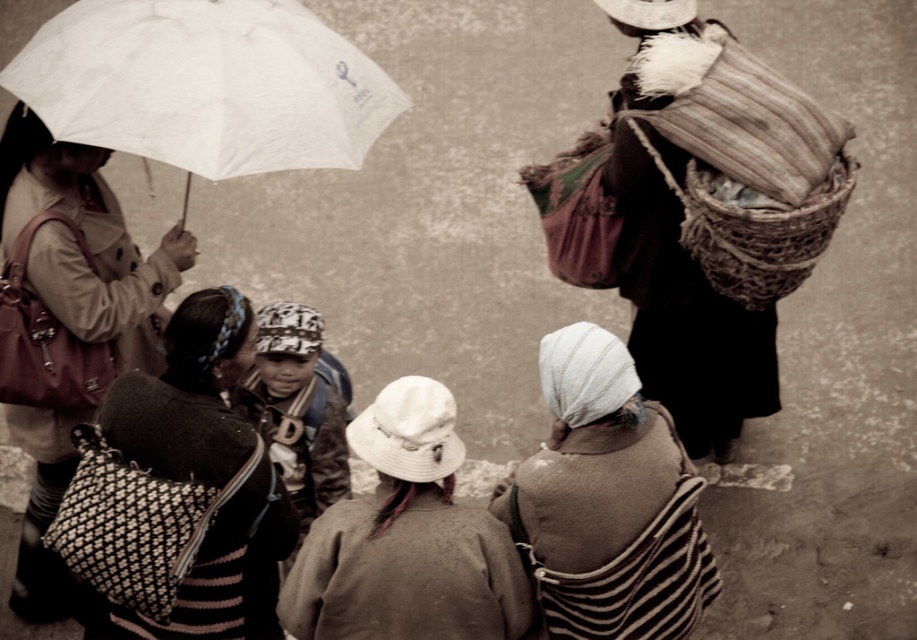
You are a photographer trying to capture a detailed shot of the white fabric hat at center and the knitted woolen bag at lower left. Since you want both items in focus, you need to know which one is wider. Which object has a greater width?

The white fabric hat at center has a greater width than the knitted woolen bag at lower left.

You are a photographer taking a picture of the scene. You notice the white matte umbrella at upper left and the white fabric hat at center. Which object is more to the left?

The white matte umbrella at upper left is more to the left than the white fabric hat at center.

You are a photographer standing at the center of the scene. You want to take a photo of the white matte umbrella at upper left and the white striped shawl at center. How far apart are these two objects?

The distance between the white matte umbrella at upper left and the white striped shawl at center is 2.28 meters.